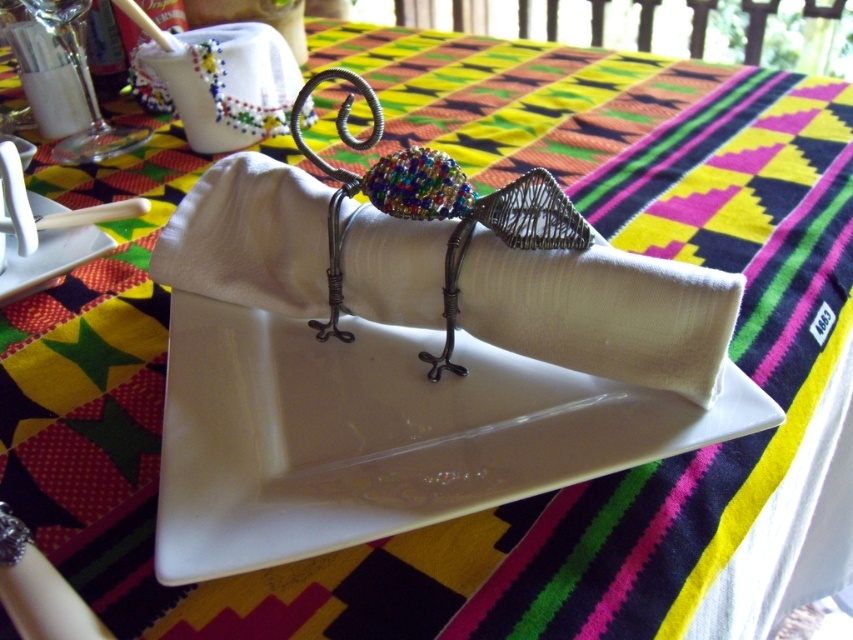
Question: Which object is farther from the camera taking this photo?

Choices:
 (A) white fabric napkin at center
 (B) white glossy plate at upper left

Answer: (B)

Question: Can you confirm if white fabric napkin at center is thinner than white glossy plate at upper left?

Choices:
 (A) no
 (B) yes

Answer: (A)

Question: In this image, where is white fabric napkin at center located relative to white glossy plate at upper left?

Choices:
 (A) left
 (B) right

Answer: (B)

Question: Is the position of white fabric napkin at center less distant than that of white glossy plate at upper left?

Choices:
 (A) yes
 (B) no

Answer: (A)

Question: Which point is closer to the camera?

Choices:
 (A) white fabric napkin at center
 (B) white glossy plate at upper left

Answer: (A)

Question: Which point is farther to the camera?

Choices:
 (A) white glossy plate at upper left
 (B) white fabric napkin at center

Answer: (A)